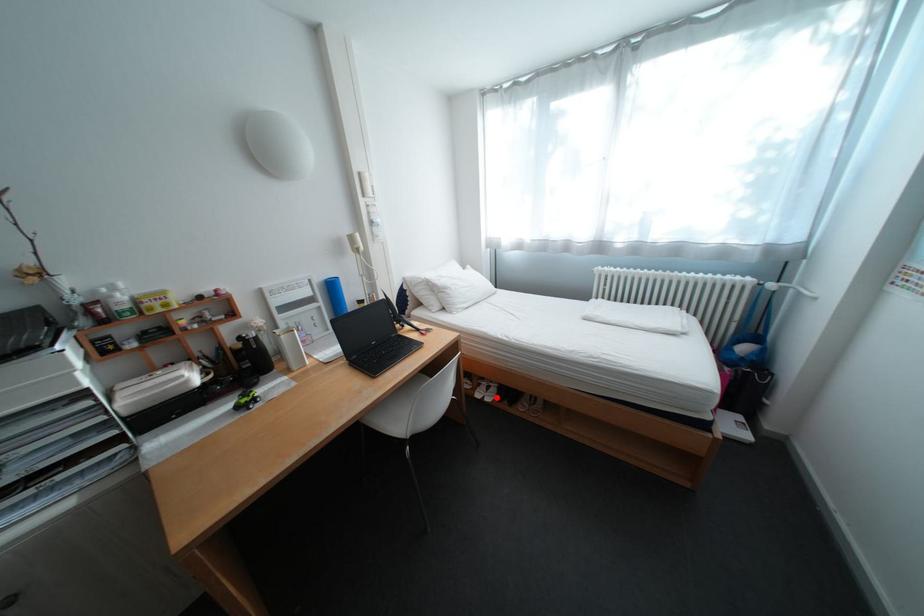
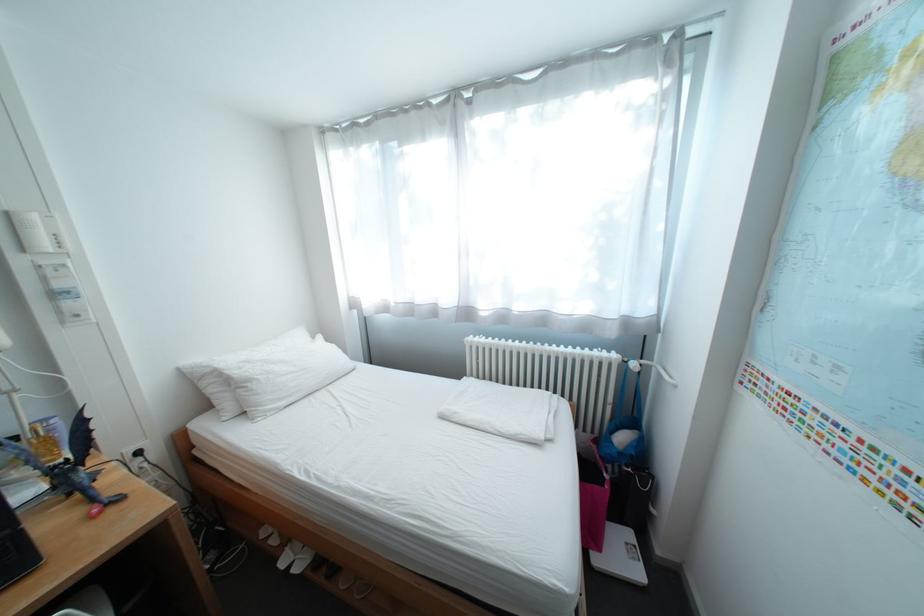
Where in the second image is the point corresponding to the highlighted location from the first image?

(307, 562)